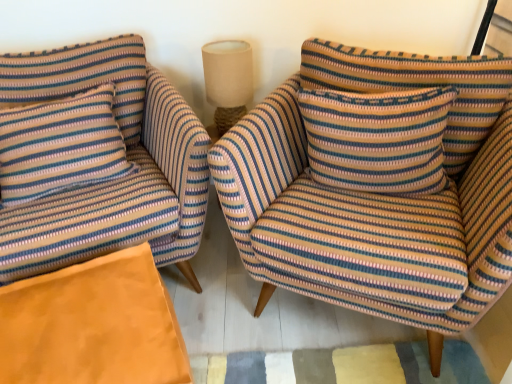
At what (x,y) coordinates should I click in order to perform the action: click on striped fabric armchair at center, marked as the 1th chair in a right-to-left arrangement. Please return your answer as a coordinate pair (x, y). The height and width of the screenshot is (384, 512). Looking at the image, I should click on (377, 196).

This screenshot has height=384, width=512. Find the location of `beige fabric lampshade at upper center`. beige fabric lampshade at upper center is located at coordinates (228, 81).

What do you see at coordinates (377, 139) in the screenshot?
I see `striped fabric pillow at center, marked as the 1th pillow in a right-to-left arrangement` at bounding box center [377, 139].

Identify the location of striped fabric armchair at left, positioned as the 2th chair in right-to-left order. The image size is (512, 384). [97, 160].

Does point (424, 199) come in front of point (343, 113)?

No.

Is striped fabric armchair at center, marked as the 1th chair in a right-to-left arrangement, taller or shorter than striped fabric pillow at center, which is the 2th pillow from left to right?

Clearly, striped fabric armchair at center, marked as the 1th chair in a right-to-left arrangement, is taller compared to striped fabric pillow at center, which is the 2th pillow from left to right.

You are a GUI agent. You are given a task and a screenshot of the screen. Output one action in this format:
    pyautogui.click(x=<x>, y=<y>)
    Task: Click on the pillow that is the 1st object located behind the striped fabric armchair at center, marked as the 1th chair in a right-to-left arrangement
    The image size is (512, 384).
    Given the screenshot: What is the action you would take?
    (x=377, y=139)

In the scene shown: From the image's perspective, who appears lower, striped fabric armchair at center, marked as the 1th chair in a right-to-left arrangement, or striped fabric pillow at center, which is the 2th pillow from left to right?

From the image's view, striped fabric armchair at center, marked as the 1th chair in a right-to-left arrangement, is below.

Considering the sizes of objects orange suede ottoman at lower left and striped fabric armchair at left, which ranks as the first chair in left-to-right order, in the image provided, who is thinner, orange suede ottoman at lower left or striped fabric armchair at left, which ranks as the first chair in left-to-right order,?

With smaller width is orange suede ottoman at lower left.

From the image's perspective, is orange suede ottoman at lower left over striped fabric armchair at left, positioned as the 2th chair in right-to-left order?

No, from the image's perspective, orange suede ottoman at lower left is not above striped fabric armchair at left, positioned as the 2th chair in right-to-left order.

Is orange suede ottoman at lower left to the right of striped fabric armchair at left, which ranks as the first chair in left-to-right order, from the viewer's perspective?

Yes.

Considering the relative sizes of striped fabric armchair at left, positioned as the 2th chair in right-to-left order, and striped fabric pillow at center, which is the 2th pillow from left to right, in the image provided, is striped fabric armchair at left, positioned as the 2th chair in right-to-left order, taller than striped fabric pillow at center, which is the 2th pillow from left to right,?

Yes.

Where is `pillow to the right of striped fabric armchair at left, positioned as the 2th chair in right-to-left order`? Image resolution: width=512 pixels, height=384 pixels. pillow to the right of striped fabric armchair at left, positioned as the 2th chair in right-to-left order is located at coordinates (377, 139).

Is striped fabric armchair at left, positioned as the 2th chair in right-to-left order, located outside striped fabric pillow at center, which is the 2th pillow from left to right?

Absolutely, striped fabric armchair at left, positioned as the 2th chair in right-to-left order, is external to striped fabric pillow at center, which is the 2th pillow from left to right.

Does striped fabric armchair at left, positioned as the 2th chair in right-to-left order, turn towards striped fabric pillow at center, which is the 2th pillow from left to right?

No, striped fabric armchair at left, positioned as the 2th chair in right-to-left order, does not turn towards striped fabric pillow at center, which is the 2th pillow from left to right.

Identify the location of lamp behind the striped fabric pillow at center, marked as the 1th pillow in a right-to-left arrangement. Image resolution: width=512 pixels, height=384 pixels. (228, 81).

Is striped fabric pillow at center, which is the 2th pillow from left to right, oriented towards beige fabric lampshade at upper center?

No, striped fabric pillow at center, which is the 2th pillow from left to right, is not aimed at beige fabric lampshade at upper center.

Choose the correct answer: Is striped fabric pillow at center, which is the 2th pillow from left to right, inside beige fabric lampshade at upper center or outside it?

striped fabric pillow at center, which is the 2th pillow from left to right, is spatially situated outside beige fabric lampshade at upper center.

Between striped fabric pillow at center, marked as the 1th pillow in a right-to-left arrangement, and beige fabric lampshade at upper center, which one is positioned behind?

beige fabric lampshade at upper center is more distant.

From the image's perspective, which one is positioned lower, striped fabric pillow at center, which is the 2th pillow from left to right, or orange suede ottoman at lower left?

orange suede ottoman at lower left appears lower in the image.

Which of these two, striped fabric pillow at center, marked as the 1th pillow in a right-to-left arrangement, or orange suede ottoman at lower left, is bigger?

Bigger between the two is orange suede ottoman at lower left.

Would you say orange suede ottoman at lower left is part of striped fabric pillow at center, marked as the 1th pillow in a right-to-left arrangement,'s contents?

Actually, orange suede ottoman at lower left is outside striped fabric pillow at center, marked as the 1th pillow in a right-to-left arrangement.

Can you tell me how much striped fabric pillow at center, marked as the 1th pillow in a right-to-left arrangement, and orange suede ottoman at lower left differ in facing direction?

striped fabric pillow at center, marked as the 1th pillow in a right-to-left arrangement, and orange suede ottoman at lower left are facing 34.2 degrees away from each other.

Is beige fabric lampshade at upper center oriented away from orange suede ottoman at lower left?

No, orange suede ottoman at lower left is not at the back of beige fabric lampshade at upper center.

How many degrees apart are the facing directions of beige fabric lampshade at upper center and orange suede ottoman at lower left?

beige fabric lampshade at upper center and orange suede ottoman at lower left are facing 25.4 degrees away from each other.

From the image's perspective, is beige fabric lampshade at upper center above or below orange suede ottoman at lower left?

beige fabric lampshade at upper center is above orange suede ottoman at lower left.

Is beige fabric lampshade at upper center closer to the viewer compared to orange suede ottoman at lower left?

No, it is not.

Are striped fabric armchair at center, which is the 2th chair from left to right, and striped fabric armchair at left, positioned as the 2th chair in right-to-left order, making contact?

No, striped fabric armchair at center, which is the 2th chair from left to right, is not with striped fabric armchair at left, positioned as the 2th chair in right-to-left order.

Would you say striped fabric armchair at left, positioned as the 2th chair in right-to-left order, is part of striped fabric armchair at center, marked as the 1th chair in a right-to-left arrangement,'s contents?

No, striped fabric armchair at left, positioned as the 2th chair in right-to-left order, is located outside of striped fabric armchair at center, marked as the 1th chair in a right-to-left arrangement.

Does striped fabric armchair at center, marked as the 1th chair in a right-to-left arrangement, come behind striped fabric armchair at left, which ranks as the first chair in left-to-right order?

That is False.

Find the location of a particular element. the 2nd pillow positioned above the striped fabric armchair at center, which is the 2th chair from left to right (from the image's perspective) is located at coordinates (377, 139).

Identify the location of the 2nd chair behind when counting from the orange suede ottoman at lower left. This screenshot has width=512, height=384. (97, 160).

When comparing their distances from striped fabric pillow at left, positioned as the first pillow in left-to-right order, does beige fabric lampshade at upper center or striped fabric armchair at center, marked as the 1th chair in a right-to-left arrangement, seem closer?

beige fabric lampshade at upper center lies closer to striped fabric pillow at left, positioned as the first pillow in left-to-right order, than the other object.

From the picture: Considering their positions, is orange suede ottoman at lower left positioned closer to striped fabric armchair at left, which ranks as the first chair in left-to-right order, than striped fabric pillow at left, positioned as the first pillow in left-to-right order?

striped fabric pillow at left, positioned as the first pillow in left-to-right order.

Considering their positions, is orange suede ottoman at lower left positioned closer to striped fabric armchair at center, which is the 2th chair from left to right, than beige fabric lampshade at upper center?

beige fabric lampshade at upper center is closer to striped fabric armchair at center, which is the 2th chair from left to right.

When comparing their distances from beige fabric lampshade at upper center, does striped fabric pillow at left, positioned as the first pillow in left-to-right order, or orange suede ottoman at lower left seem closer?

The object closer to beige fabric lampshade at upper center is striped fabric pillow at left, positioned as the first pillow in left-to-right order.

Based on their spatial positions, is striped fabric pillow at center, marked as the 1th pillow in a right-to-left arrangement, or beige fabric lampshade at upper center closer to striped fabric armchair at center, marked as the 1th chair in a right-to-left arrangement?

striped fabric pillow at center, marked as the 1th pillow in a right-to-left arrangement, is closer to striped fabric armchair at center, marked as the 1th chair in a right-to-left arrangement.

Estimate the real-world distances between objects in this image. Which object is further from striped fabric pillow at center, marked as the 1th pillow in a right-to-left arrangement, striped fabric armchair at center, which is the 2th chair from left to right, or striped fabric pillow at left, which appears as the second pillow when viewed from the right?

striped fabric pillow at left, which appears as the second pillow when viewed from the right, is positioned further to the anchor striped fabric pillow at center, marked as the 1th pillow in a right-to-left arrangement.

Looking at the image, which one is located further to striped fabric armchair at left, which ranks as the first chair in left-to-right order, beige fabric lampshade at upper center or striped fabric pillow at left, which appears as the second pillow when viewed from the right?

beige fabric lampshade at upper center.

Which object lies further to the anchor point striped fabric armchair at center, which is the 2th chair from left to right, orange suede ottoman at lower left or striped fabric armchair at left, which ranks as the first chair in left-to-right order?

orange suede ottoman at lower left is positioned further to the anchor striped fabric armchair at center, which is the 2th chair from left to right.

Image resolution: width=512 pixels, height=384 pixels. Identify the location of material between striped fabric pillow at left, positioned as the first pillow in left-to-right order, and striped fabric pillow at center, marked as the 1th pillow in a right-to-left arrangement, from left to right. (93, 325).

The height and width of the screenshot is (384, 512). Identify the location of chair between striped fabric pillow at left, positioned as the first pillow in left-to-right order, and striped fabric pillow at center, which is the 2th pillow from left to right, in the horizontal direction. (97, 160).

Identify the location of chair between striped fabric pillow at left, positioned as the first pillow in left-to-right order, and beige fabric lampshade at upper center. (97, 160).

Identify the location of lamp located between striped fabric armchair at left, which ranks as the first chair in left-to-right order, and striped fabric armchair at center, which is the 2th chair from left to right, in the left-right direction. The image size is (512, 384). (228, 81).